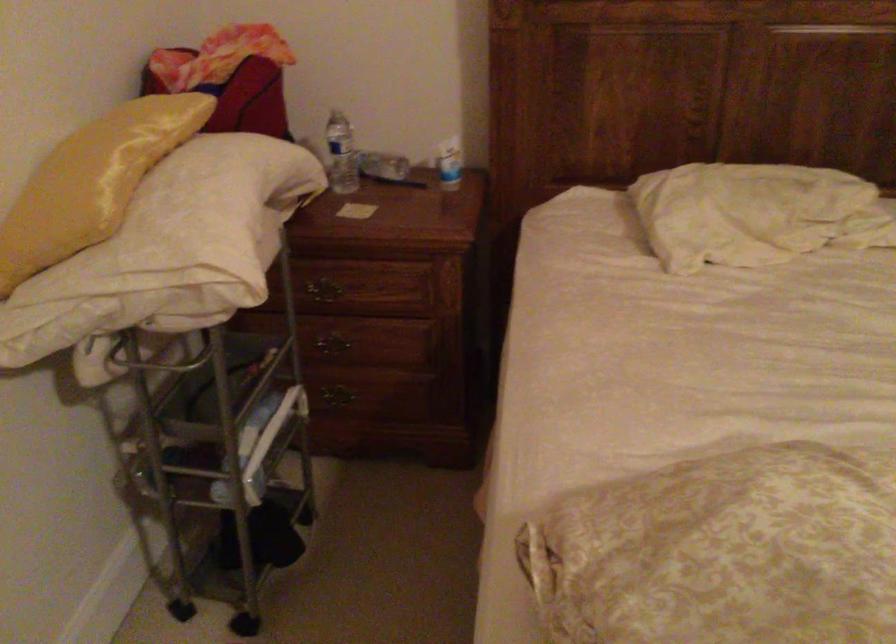
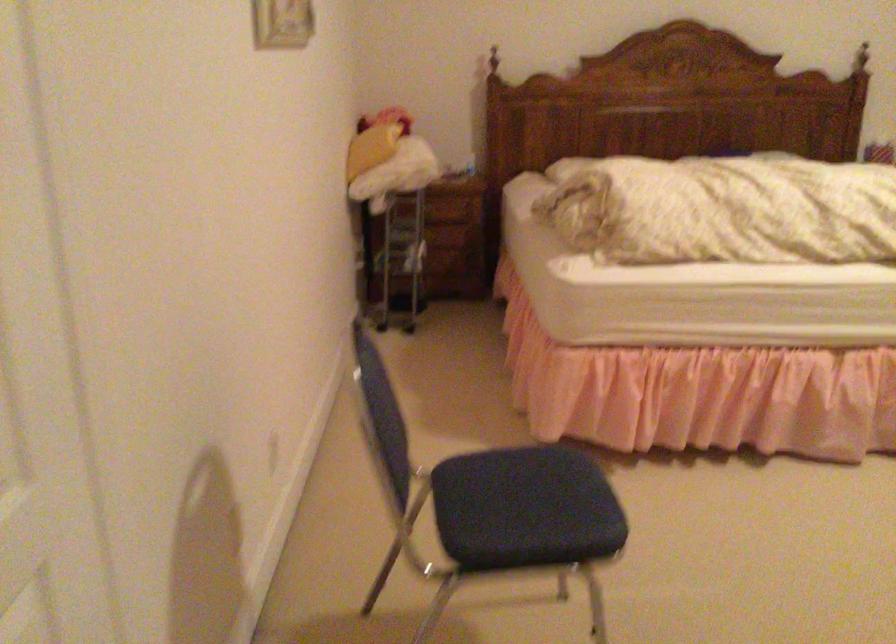
Question: What movement of the cameraman would produce the second image?

Choices:
 (A) Left
 (B) Right
 (C) Forward
 (D) Backward

Answer: (D)